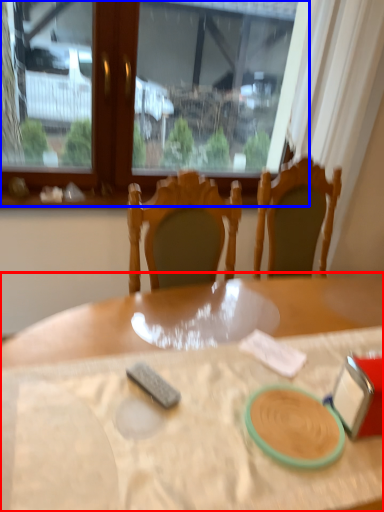
Question: Which object is further to the camera taking this photo, table (highlighted by a red box) or window (highlighted by a blue box)?

Choices:
 (A) table
 (B) window

Answer: (B)